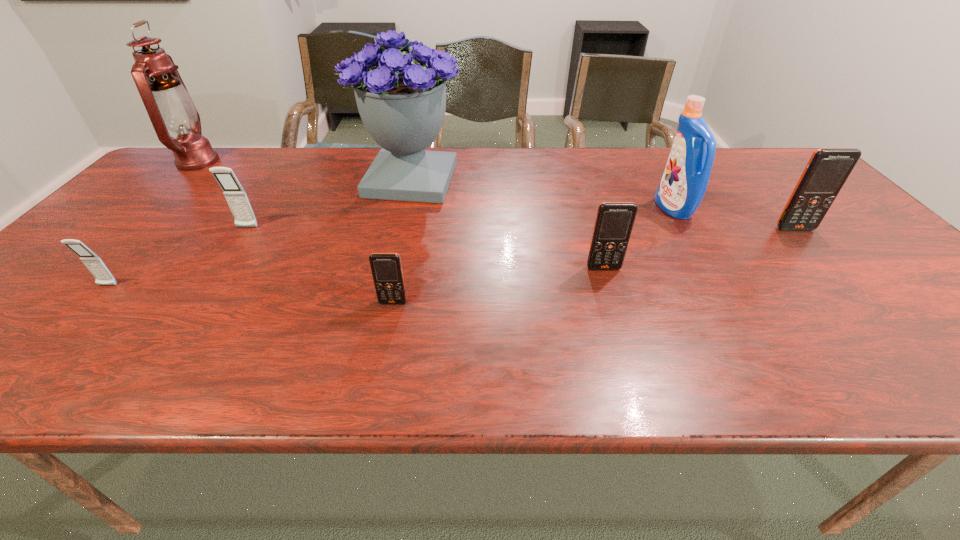
Identify the location of blank area located 0.400m on the front-facing side of the farther gray cellular telephone. (163, 353).

The height and width of the screenshot is (540, 960). I want to click on free space located 0.300m on the screen of the third nearest cellular telephone, so click(x=638, y=380).

In order to click on free spot located 0.130m on the screen of the nearest orange cellular telephone in this screenshot , I will do `click(382, 354)`.

This screenshot has width=960, height=540. In order to click on blank area located 0.110m on the front-facing side of the smaller gray cellular telephone in this screenshot , I will do `click(71, 325)`.

Locate an element on the screen. The image size is (960, 540). oil lamp located in the far edge section of the desktop is located at coordinates (170, 107).

This screenshot has height=540, width=960. I want to click on bouquet present at the far edge, so click(402, 105).

Find the location of a particular element. The height and width of the screenshot is (540, 960). oil lamp that is at the left edge is located at coordinates (170, 107).

Where is `cellular telephone that is at the left edge`? The image size is (960, 540). cellular telephone that is at the left edge is located at coordinates (95, 265).

In order to click on object present at the right edge in this screenshot , I will do `click(826, 172)`.

Where is `object that is at the far left corner`? Image resolution: width=960 pixels, height=540 pixels. object that is at the far left corner is located at coordinates (170, 107).